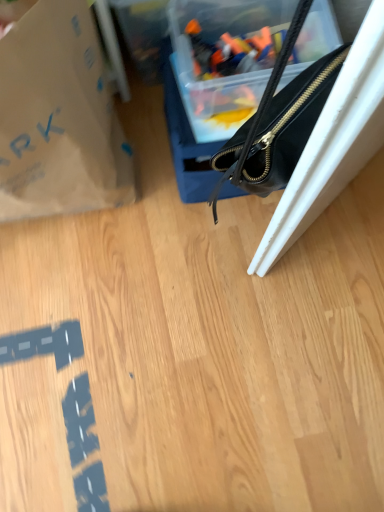
You are a GUI agent. You are given a task and a screenshot of the screen. Output one action in this format:
    pyautogui.click(x=<x>, y=<y>)
    Task: Click on the free space between brown paper bag at upper left and black leather handbag at upper right
    The height and width of the screenshot is (512, 384).
    Given the screenshot: What is the action you would take?
    pyautogui.click(x=144, y=169)